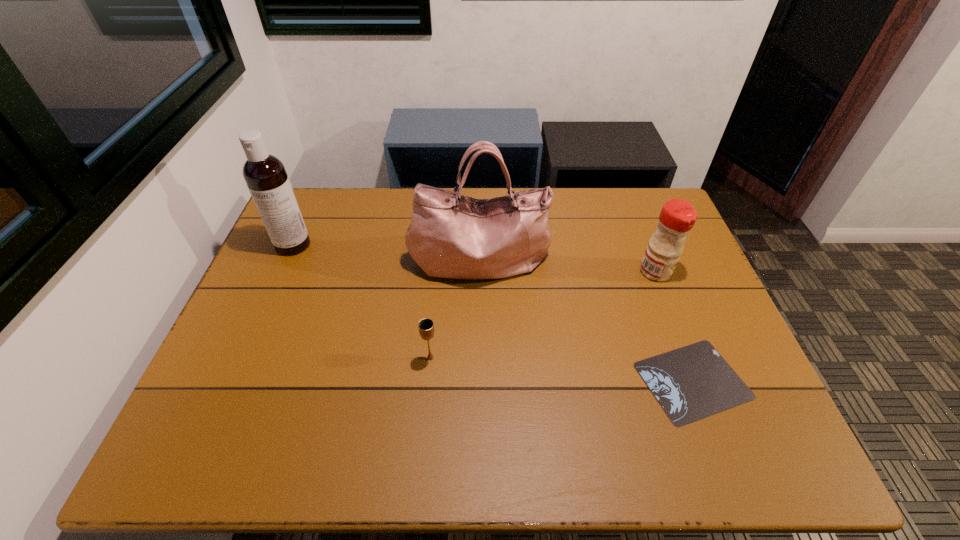
At what (x,y) coordinates should I click in order to perform the action: click on vacant area that satisfies the following two spatial constraints: 1. on the label side of the chalice; 2. on the right side of the dishwasher detergent. Please return your answer as a coordinate pair (x, y). The width and height of the screenshot is (960, 540). Looking at the image, I should click on (244, 357).